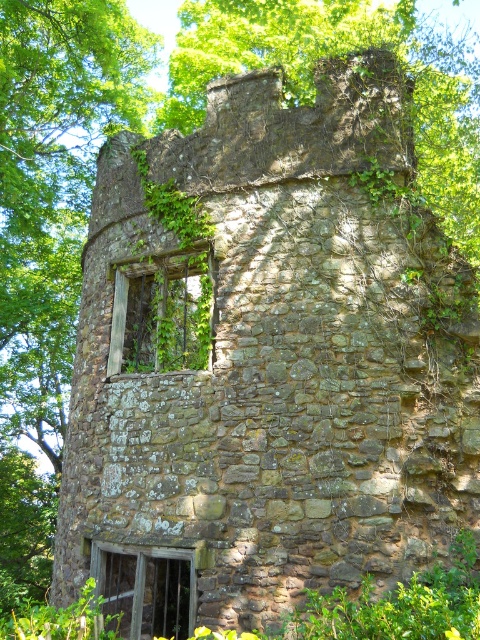
You are an architect examining the old stone structure. You need to determine which window, the green mossy stone window at upper left or the wooden textured window at lower left, requires more urgent repair based on their height differences. Which window should you prioritize?

The green mossy stone window at upper left is taller than the wooden textured window at lower left. Since taller windows may require more materials and structural support, the green mossy stone window at upper left should be prioritized for repair.

You are an architect assessing the structural integrity of the old stone structure. You notice two windows in the scene. Which window, the green mossy stone window at upper left or the wooden textured window at lower left, has a greater width according to the description?

The green mossy stone window at upper left might be wider than wooden textured window at lower left according to the description.